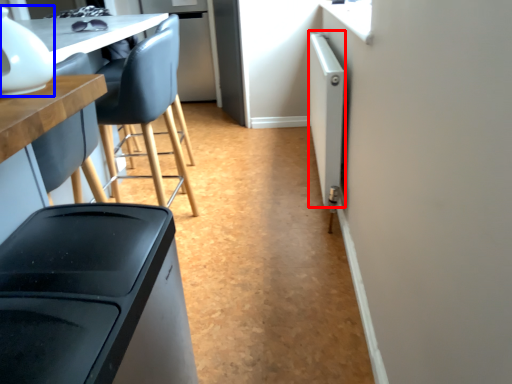
Question: Among these objects, which one is nearest to the camera, appliance (highlighted by a red box) or appliance (highlighted by a blue box)?

Choices:
 (A) appliance
 (B) appliance

Answer: (B)